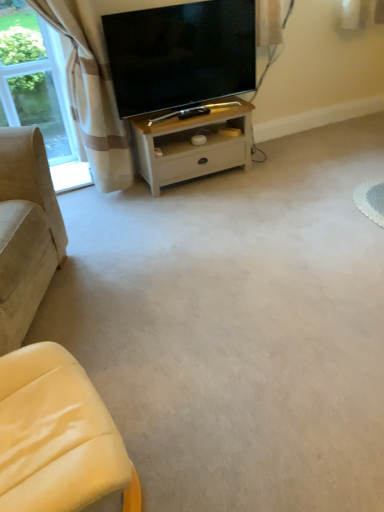
Question: Looking at the image, does white wood table at center seem bigger or smaller compared to beige corduroy couch at left, positioned as the 1th studio couch in left-to-right order?

Choices:
 (A) small
 (B) big

Answer: (A)

Question: Visually, is white wood table at center positioned to the left or to the right of beige corduroy couch at left, positioned as the 1th studio couch in left-to-right order?

Choices:
 (A) left
 (B) right

Answer: (B)

Question: Considering the real-world distances, which object is farthest from the matte black tv at upper center?

Choices:
 (A) white wood table at center
 (B) yellow leather studio couch at lower left, which appears as the second studio couch when viewed from the left
 (C) beige corduroy couch at left, arranged as the 2th studio couch when viewed from the right
 (D) clear glass window at upper left
 (E) beige plaid curtain at upper left

Answer: (B)

Question: Which is nearer to the matte black tv at upper center?

Choices:
 (A) white wood table at center
 (B) beige plaid curtain at upper left
 (C) clear glass window at upper left
 (D) yellow leather studio couch at lower left, which appears as the second studio couch when viewed from the left
 (E) beige corduroy couch at left, positioned as the 1th studio couch in left-to-right order

Answer: (A)